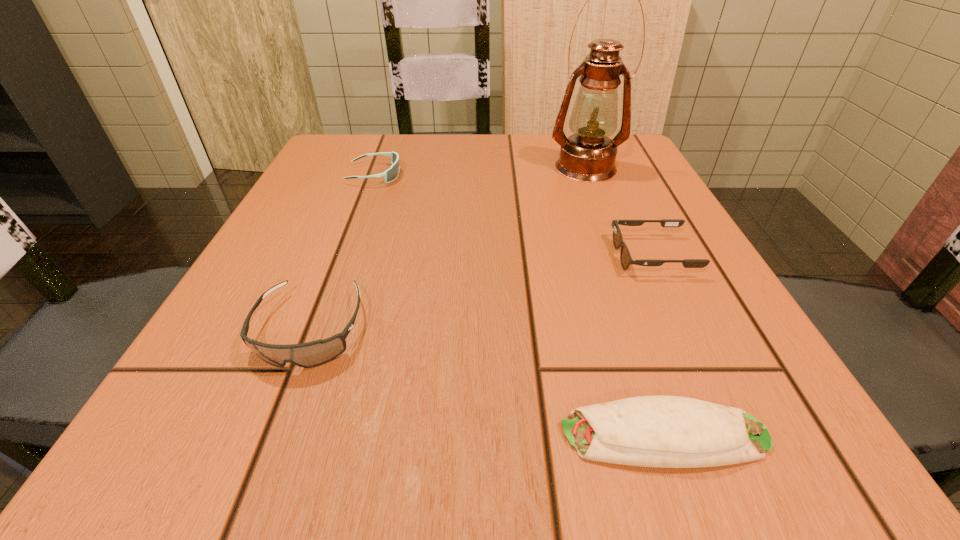
Locate which object is the closest to the shorter goggles. Please provide its 2D coordinates. Your answer should be formatted as a tuple, i.e. [(x, y)], where the tuple contains the x and y coordinates of a point satisfying the conditions above.

[(311, 354)]

Identify which object is the third nearest to the oil lamp. Please provide its 2D coordinates. Your answer should be formatted as a tuple, i.e. [(x, y)], where the tuple contains the x and y coordinates of a point satisfying the conditions above.

[(311, 354)]

Where is `free space that satisfies the following two spatial constraints: 1. on the front side of the oil lamp; 2. at the bitten end of the nearest object`? The width and height of the screenshot is (960, 540). free space that satisfies the following two spatial constraints: 1. on the front side of the oil lamp; 2. at the bitten end of the nearest object is located at coordinates (688, 435).

Find the location of `free spot that satisfies the following two spatial constraints: 1. on the temples of the third farthest object; 2. on the lenses of the fourth shortest object`. free spot that satisfies the following two spatial constraints: 1. on the temples of the third farthest object; 2. on the lenses of the fourth shortest object is located at coordinates (688, 329).

At what (x,y) coordinates should I click in order to perform the action: click on free space that satisfies the following two spatial constraints: 1. on the temples of the sunglasses; 2. on the lenses of the nearer goggles. Please return your answer as a coordinate pair (x, y). This screenshot has width=960, height=540. Looking at the image, I should click on (688, 329).